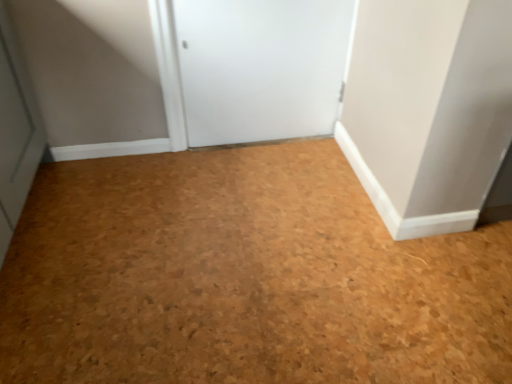
Question: In terms of width, does white matte door at center look wider or thinner when compared to cork floor at center?

Choices:
 (A) wide
 (B) thin

Answer: (B)

Question: In terms of size, does white matte door at center appear bigger or smaller than cork floor at center?

Choices:
 (A) small
 (B) big

Answer: (A)

Question: In terms of height, does white matte door at center look taller or shorter compared to cork floor at center?

Choices:
 (A) tall
 (B) short

Answer: (A)

Question: Is cork floor at center situated inside white matte door at center or outside?

Choices:
 (A) outside
 (B) inside

Answer: (A)

Question: Is point (92, 261) positioned closer to the camera than point (266, 69)?

Choices:
 (A) closer
 (B) farther

Answer: (A)

Question: From a real-world perspective, is cork floor at center above or below white matte door at center?

Choices:
 (A) below
 (B) above

Answer: (A)

Question: In terms of size, does cork floor at center appear bigger or smaller than white matte door at center?

Choices:
 (A) small
 (B) big

Answer: (B)